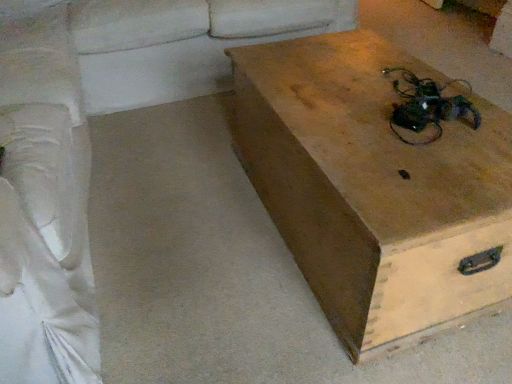
Image resolution: width=512 pixels, height=384 pixels. I want to click on free location to the left of wooden box at center, so click(x=196, y=215).